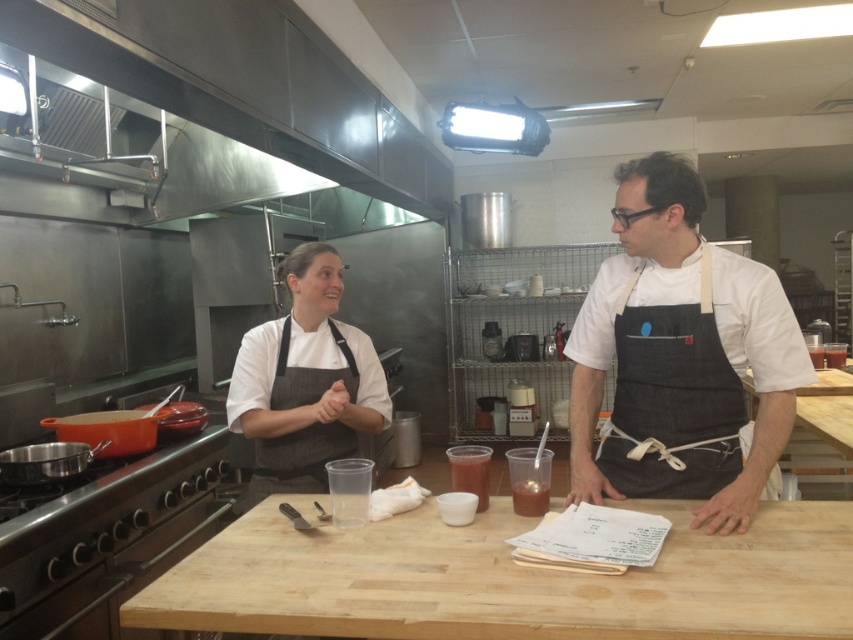
Question: Is dark gray apron at center positioned before denim apron at center?

Choices:
 (A) no
 (B) yes

Answer: (B)

Question: Is dark gray apron at center to the right of denim apron at center from the viewer's perspective?

Choices:
 (A) no
 (B) yes

Answer: (A)

Question: Among these objects, which one is farthest from the camera?

Choices:
 (A) denim apron at center
 (B) dark gray apron at center

Answer: (A)

Question: Based on their relative distances, which object is nearer to the black canvas apron at center?

Choices:
 (A) matte gray apron at center
 (B) light brown wood at center
 (C) dark gray apron at center
 (D) denim apron at center

Answer: (C)

Question: Does dark gray apron at center appear under matte gray apron at center?

Choices:
 (A) yes
 (B) no

Answer: (B)

Question: Which point is closer to the camera?

Choices:
 (A) (770, 326)
 (B) (277, 452)
 (C) (668, 275)

Answer: (A)